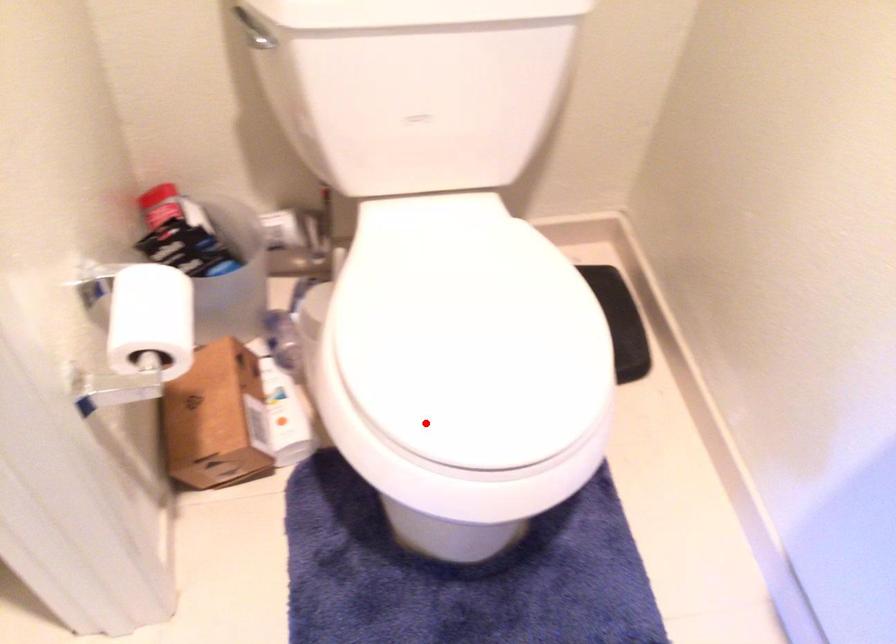
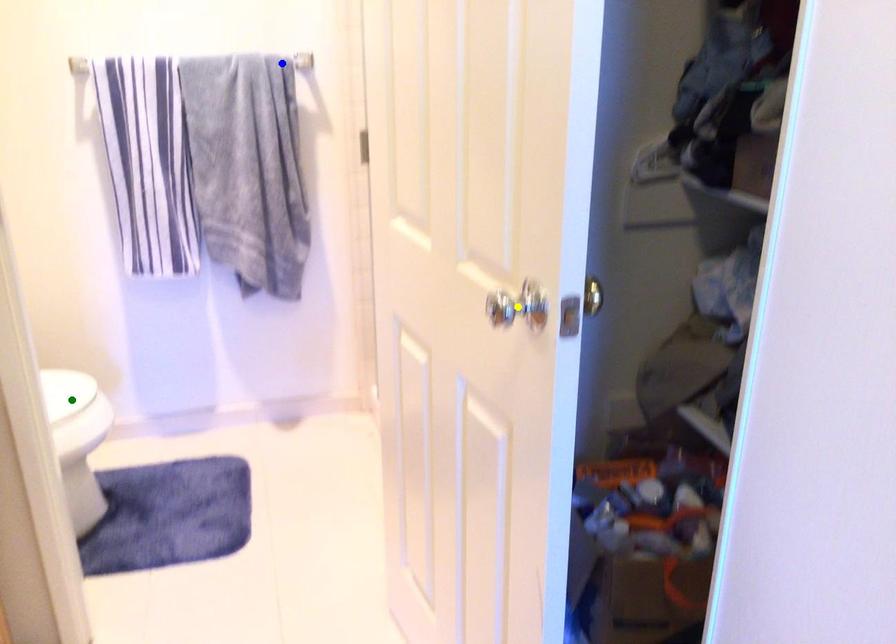
Question: I am providing you with two images of the same scene from different viewpoints. A red point is marked on the first image. You are given multiple points on the second image. In image 2, which mark is for the same physical point as the one in image 1?

Choices:
 (A) yellow point
 (B) green point
 (C) blue point

Answer: (B)